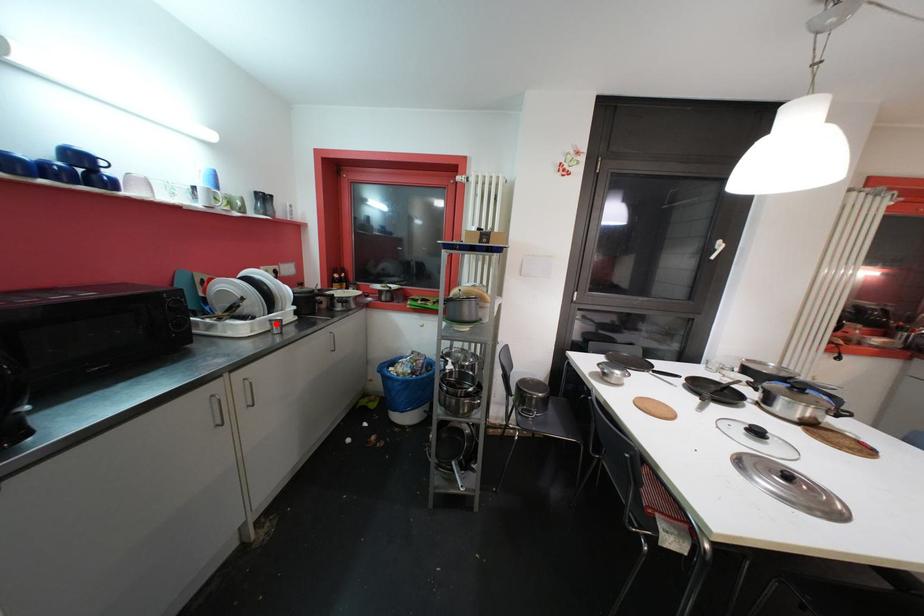
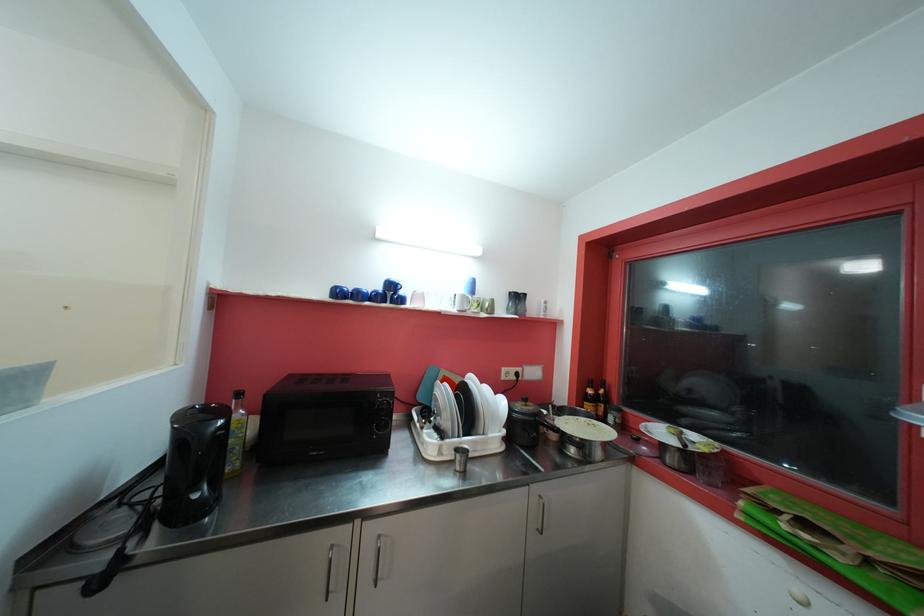
The point at the highlighted location is marked in the first image. Where is the corresponding point in the second image?

(462, 452)